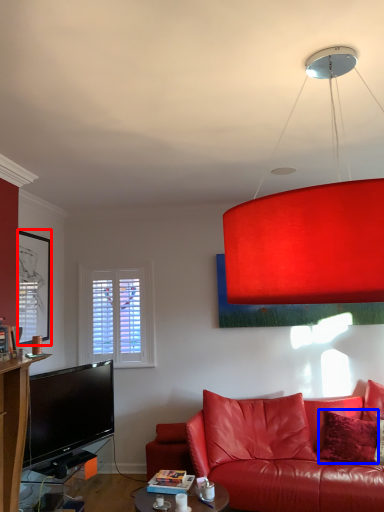
Question: Which point is closer to the camera, picture frame (highlighted by a red box) or pillow (highlighted by a blue box)?

Choices:
 (A) picture frame
 (B) pillow

Answer: (B)